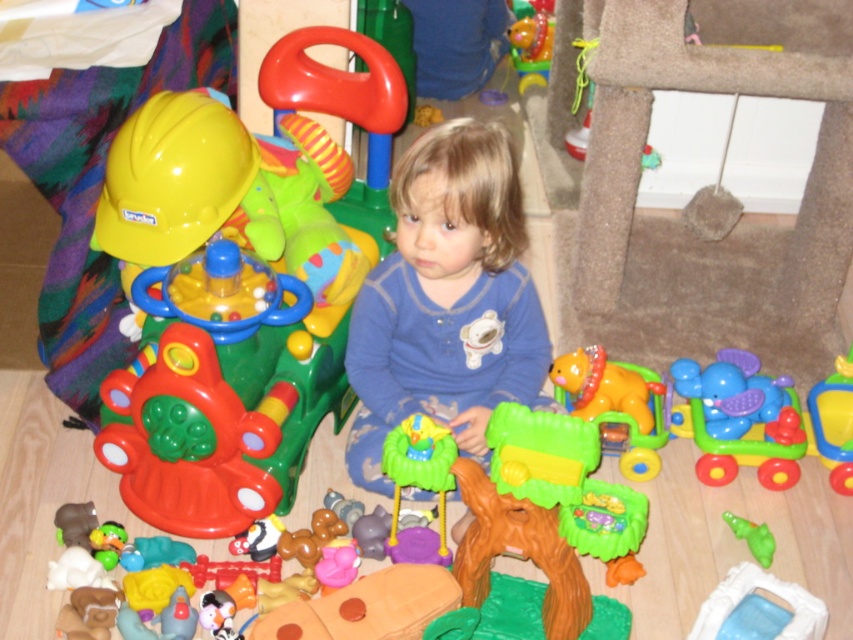
Is point (136, 209) positioned in front of point (704, 444)?

Yes.

Can you confirm if matte plastic construction helmet at left is positioned above blue plastic elephant walker at lower right?

Yes.

Identify the location of matte plastic construction helmet at left. (239, 284).

Is point (172, 522) closer to camera compared to point (621, 404)?

Yes.

Does matte plastic construction helmet at left appear over shiny yellow plastic toy car at lower center?

Indeed, matte plastic construction helmet at left is positioned over shiny yellow plastic toy car at lower center.

The image size is (853, 640). Identify the location of matte plastic construction helmet at left. (239, 284).

I want to click on matte plastic construction helmet at left, so click(x=239, y=284).

Consider the image. Does rubber duck at center come behind green rubber duck at lower right?

Yes.

Describe the element at coordinates (834, 422) in the screenshot. The width and height of the screenshot is (853, 640). I see `rubber duck at center` at that location.

Find the location of `rubber duck at center`. rubber duck at center is located at coordinates (834, 422).